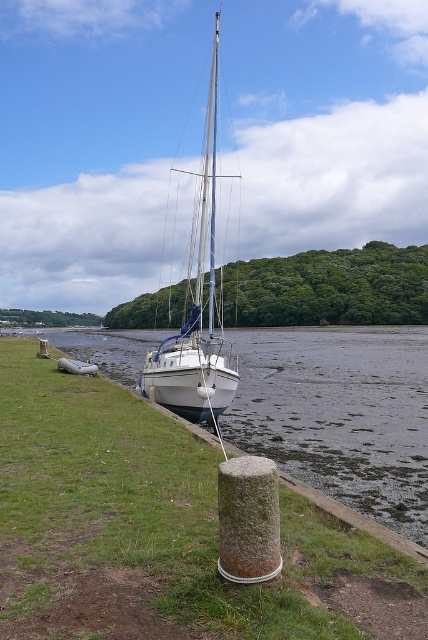
You are standing at the center of the white sailboat with a mast and rigging docked at low tide on the muddy banks. You want to walk to the green grass at lower left. Which direction should you head towards?

You should head towards the lower left direction to reach the green grass at lower left since it is located at point (160, 531), which is the lower left area of the image.

You are standing at the edge of the grassy area near the concrete bollard and want to walk to the sailboat. Which point, point (281, 620) or point (259, 538), is closer to you as you start your walk?

Point (281, 620) is closer to the viewer than point (259, 538), so it is the closer point to you as you start your walk.

You are standing on the grassy area to the left of the white glossy sailboat at center and want to walk to the green mossy stone pillar at lower center. Which direction should you head towards?

The white glossy sailboat at center is located above the green mossy stone pillar at lower center, so you should head downward towards the green mossy stone pillar at lower center.